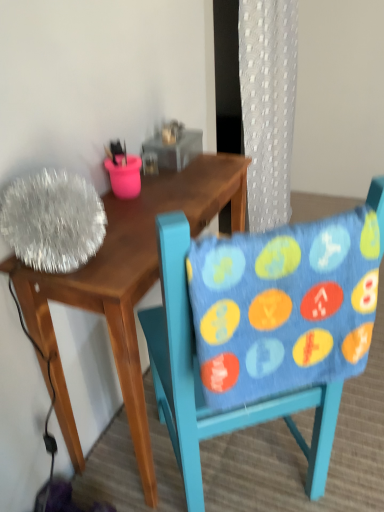
Locate an element on the screen. This screenshot has width=384, height=512. free space above wooden desk at left (from a real-world perspective) is located at coordinates (157, 196).